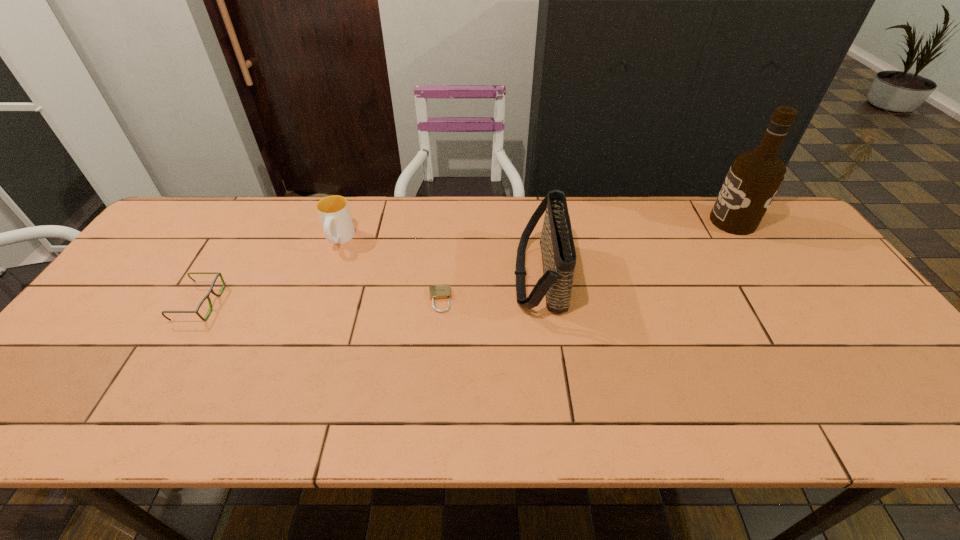
Find the location of `object that is at the right edge`. object that is at the right edge is located at coordinates (754, 178).

The width and height of the screenshot is (960, 540). I want to click on object that is positioned at the far right corner, so click(x=754, y=178).

Locate an element on the screen. This screenshot has width=960, height=540. vacant space at the far edge is located at coordinates (602, 212).

In the image, there is a desktop. Identify the location of free region at the near edge. The width and height of the screenshot is (960, 540). (630, 426).

Locate an element on the screen. blank space at the left edge of the desktop is located at coordinates (154, 285).

Image resolution: width=960 pixels, height=540 pixels. I want to click on vacant area at the right edge of the desktop, so click(849, 310).

Image resolution: width=960 pixels, height=540 pixels. In order to click on free space at the near left corner in this screenshot , I will do `click(57, 423)`.

I want to click on free location at the far right corner, so click(x=780, y=228).

Locate an element on the screen. free area in between the cup and the second shortest object is located at coordinates (269, 272).

Where is `free spot between the spectacles and the alcohol`? Image resolution: width=960 pixels, height=540 pixels. free spot between the spectacles and the alcohol is located at coordinates (467, 262).